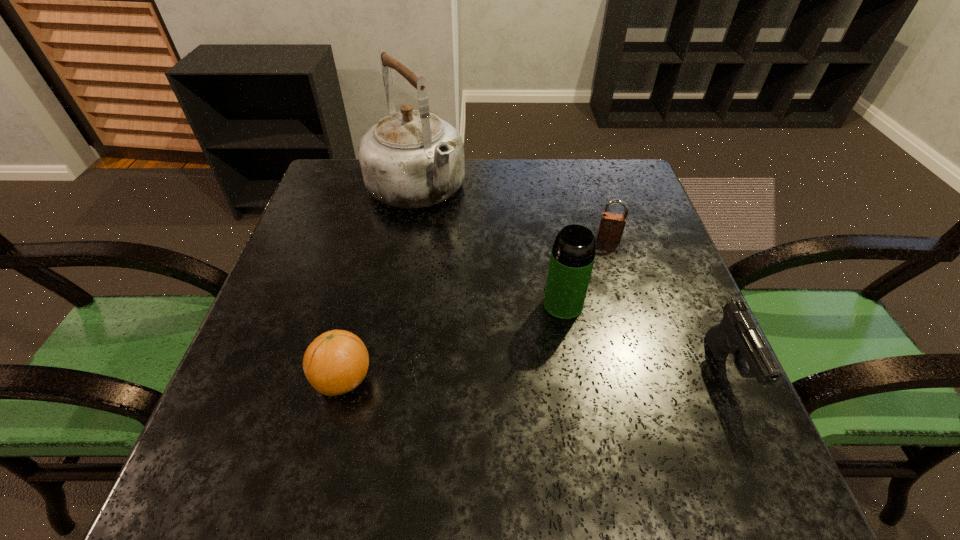
This screenshot has height=540, width=960. In order to click on free point between the thermos bottle and the kettle in this screenshot , I will do `click(490, 247)`.

Identify the location of the closest object to the rightmost object. The width and height of the screenshot is (960, 540). (573, 253).

Where is `object that is the nearest to the third nearest object`? This screenshot has height=540, width=960. object that is the nearest to the third nearest object is located at coordinates (611, 227).

This screenshot has height=540, width=960. I want to click on free space that satisfies the following two spatial constraints: 1. on the back side of the kettle; 2. on the right side of the orange, so click(x=390, y=190).